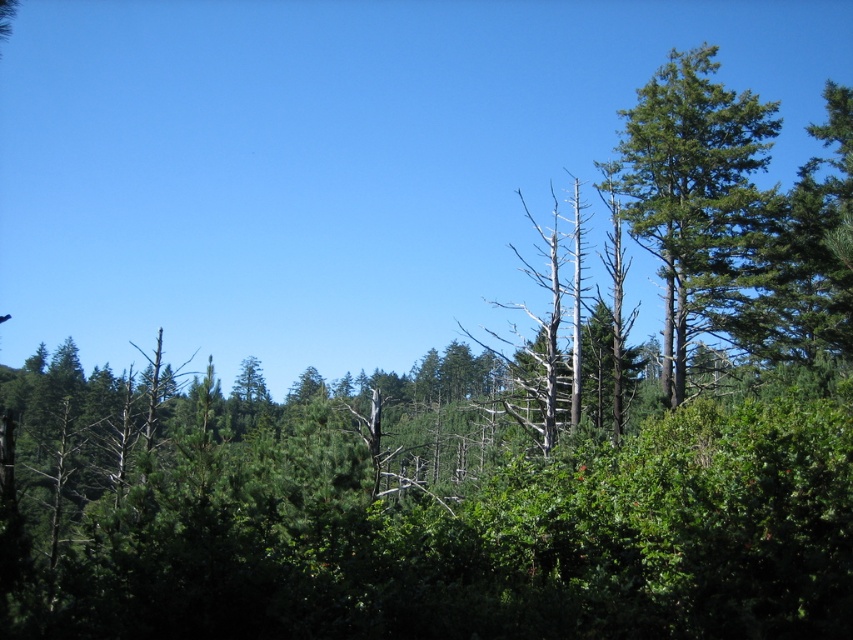
Question: Can you confirm if green textured tree at right is positioned to the right of dead wood tree at center?

Choices:
 (A) yes
 (B) no

Answer: (A)

Question: Is green textured tree at right above dead wood tree at center?

Choices:
 (A) no
 (B) yes

Answer: (B)

Question: Which object appears farthest from the camera in this image?

Choices:
 (A) dead wood tree at center
 (B) green textured tree at right

Answer: (B)

Question: Which point is closer to the camera taking this photo?

Choices:
 (A) (720, 116)
 (B) (550, 346)

Answer: (B)

Question: Does green textured tree at right lie in front of dead wood tree at center?

Choices:
 (A) yes
 (B) no

Answer: (B)